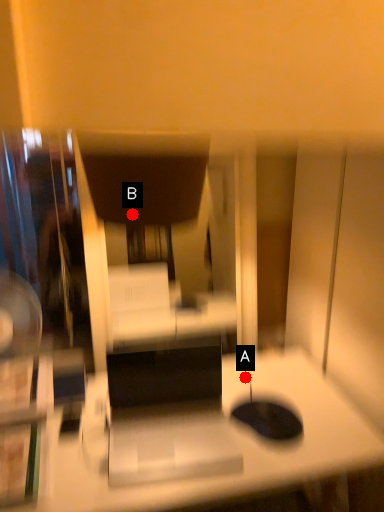
Question: Two points are circled on the image, labeled by A and B beside each circle. Which point is farther to the camera?

Choices:
 (A) A is further
 (B) B is further

Answer: (A)